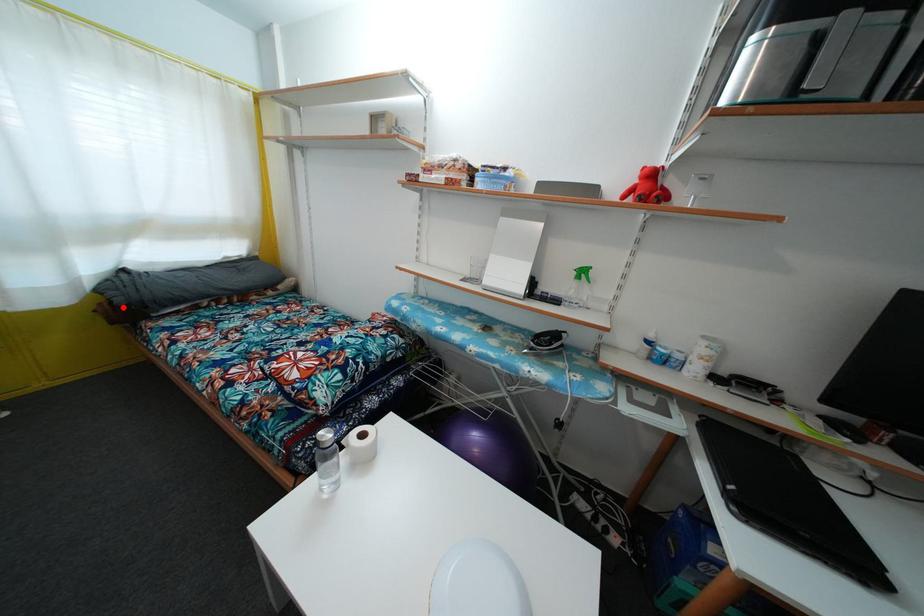
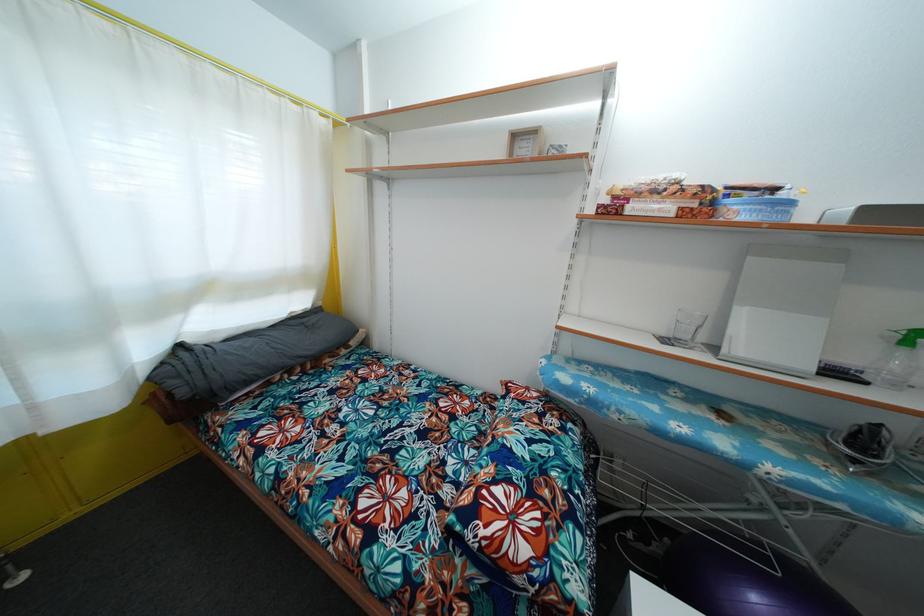
The point at the highlighted location is marked in the first image. Where is the corresponding point in the second image?

(187, 399)